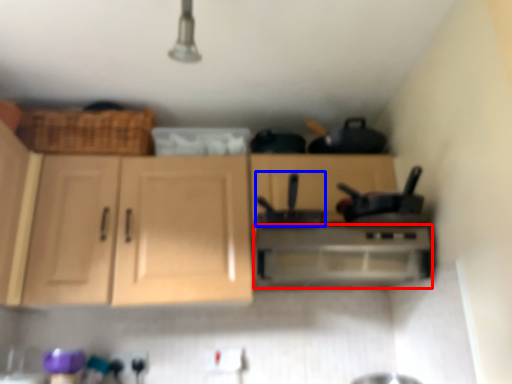
Question: Among these objects, which one is farthest to the camera, home appliance (highlighted by a red box) or appliance (highlighted by a blue box)?

Choices:
 (A) home appliance
 (B) appliance

Answer: (A)